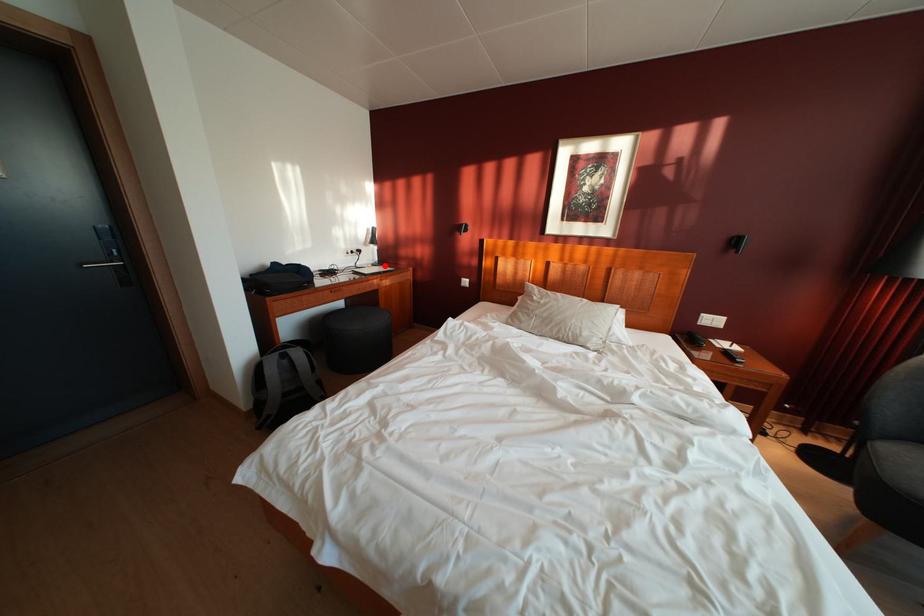
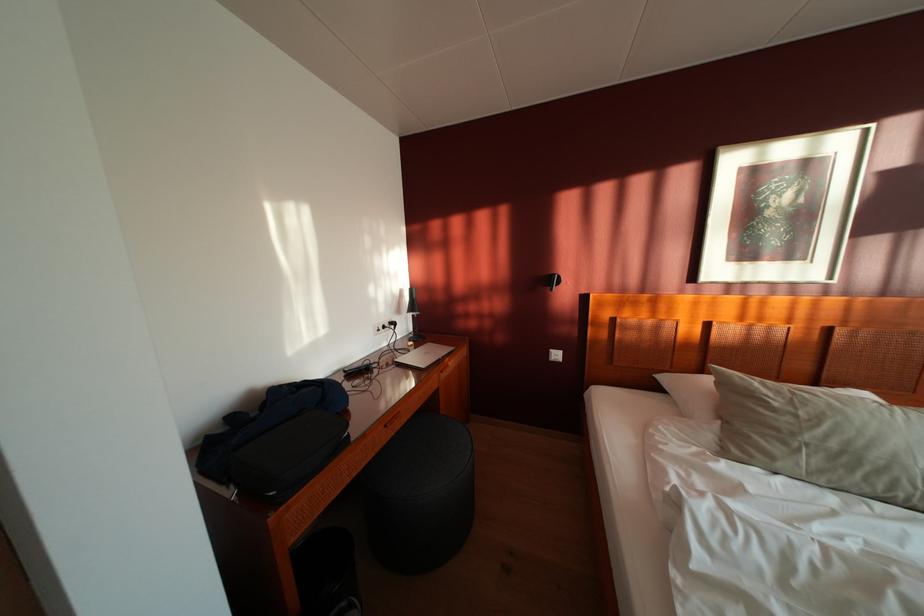
The point at the highlighted location is marked in the first image. Where is the corresponding point in the second image?

(419, 334)